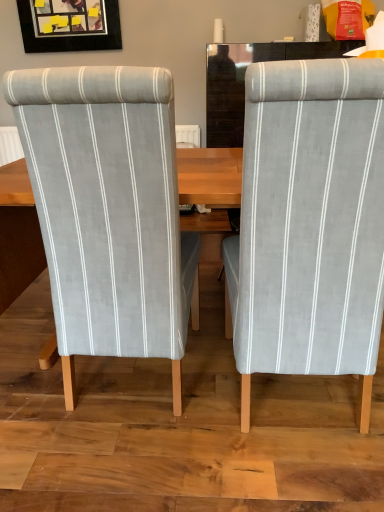
Question: Considering the relative positions of light gray fabric chair at left, the 2th chair positioned from the right, and matte black picture frame at upper left in the image provided, is light gray fabric chair at left, the 2th chair positioned from the right, behind matte black picture frame at upper left?

Choices:
 (A) yes
 (B) no

Answer: (B)

Question: Could you tell me if light gray fabric chair at left, the first chair in the left-to-right sequence, is facing matte black picture frame at upper left?

Choices:
 (A) no
 (B) yes

Answer: (A)

Question: Considering the relative positions of light gray fabric chair at left, the 2th chair positioned from the right, and matte black picture frame at upper left in the image provided, is light gray fabric chair at left, the 2th chair positioned from the right, in front of matte black picture frame at upper left?

Choices:
 (A) yes
 (B) no

Answer: (A)

Question: Is light gray fabric chair at left, the 2th chair positioned from the right, wider than matte black picture frame at upper left?

Choices:
 (A) no
 (B) yes

Answer: (B)

Question: Is light gray fabric chair at left, the 2th chair positioned from the right, thinner than matte black picture frame at upper left?

Choices:
 (A) no
 (B) yes

Answer: (A)

Question: Is matte black picture frame at upper left situated inside light gray fabric chair at left, the first chair in the left-to-right sequence, or outside?

Choices:
 (A) outside
 (B) inside

Answer: (A)

Question: Based on their sizes in the image, would you say matte black picture frame at upper left is bigger or smaller than light gray fabric chair at left, the 2th chair positioned from the right?

Choices:
 (A) small
 (B) big

Answer: (A)

Question: Is matte black picture frame at upper left taller or shorter than light gray fabric chair at left, the 2th chair positioned from the right?

Choices:
 (A) tall
 (B) short

Answer: (B)

Question: From a real-world perspective, is matte black picture frame at upper left positioned above or below light gray fabric chair at left, the first chair in the left-to-right sequence?

Choices:
 (A) above
 (B) below

Answer: (A)

Question: Looking at their shapes, would you say light gray fabric chair at right, acting as the 1th chair starting from the right, is wider or thinner than matte black picture frame at upper left?

Choices:
 (A) wide
 (B) thin

Answer: (A)

Question: From a real-world perspective, is light gray fabric chair at right, acting as the 1th chair starting from the right, positioned above or below matte black picture frame at upper left?

Choices:
 (A) below
 (B) above

Answer: (A)

Question: Considering their positions, is light gray fabric chair at right, acting as the 1th chair starting from the right, located in front of or behind matte black picture frame at upper left?

Choices:
 (A) front
 (B) behind

Answer: (A)

Question: From the image's perspective, relative to matte black picture frame at upper left, is light gray fabric chair at right, acting as the 1th chair starting from the right, above or below?

Choices:
 (A) above
 (B) below

Answer: (B)

Question: Is light gray fabric chair at left, the first chair in the left-to-right sequence, taller or shorter than matte black picture frame at upper left?

Choices:
 (A) short
 (B) tall

Answer: (B)

Question: Visually, is light gray fabric chair at left, the first chair in the left-to-right sequence, positioned to the left or to the right of matte black picture frame at upper left?

Choices:
 (A) left
 (B) right

Answer: (B)